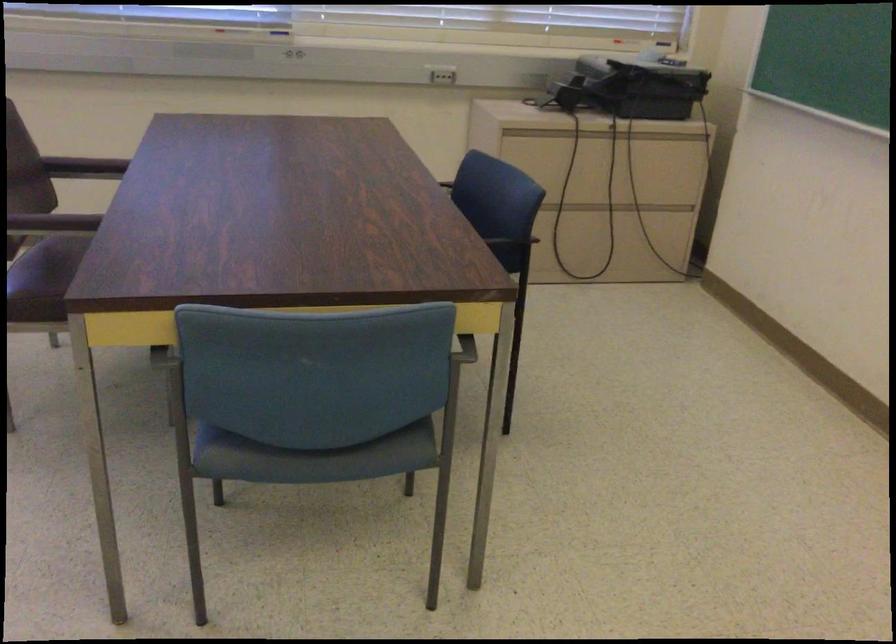
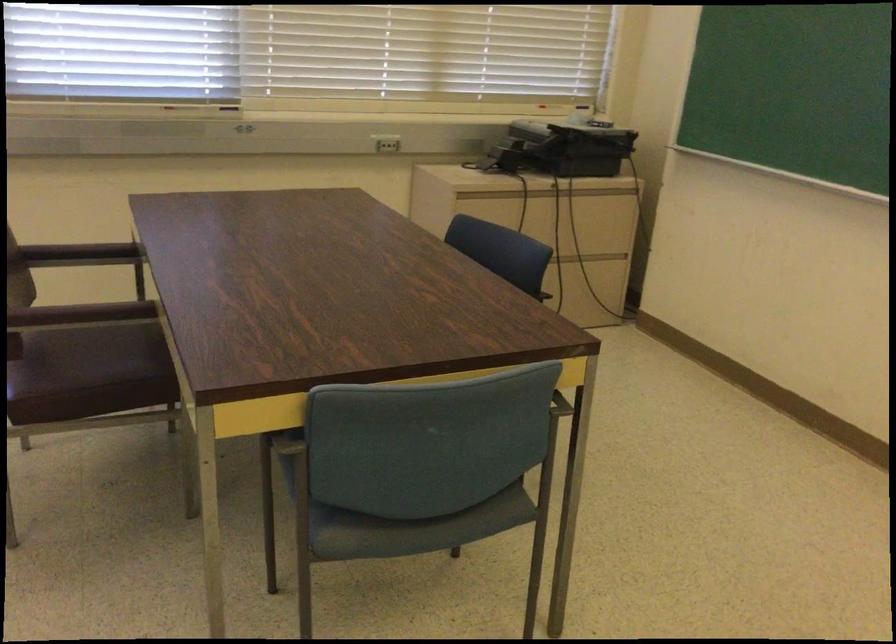
Question: The images are taken continuously from a first-person perspective. In which direction are you moving?

Choices:
 (A) Left
 (B) Right
 (C) Forward
 (D) Backward

Answer: (A)